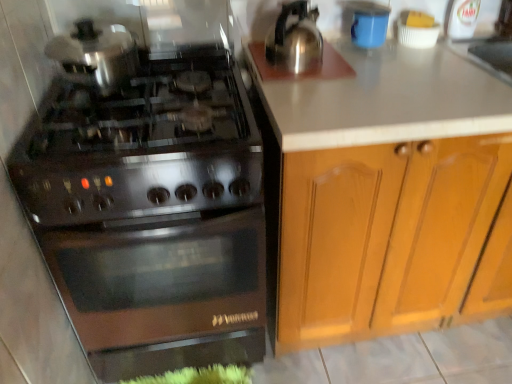
Find the location of a particular element. The height and width of the screenshot is (384, 512). free space that is to the left of blue matte cup at upper right is located at coordinates (327, 48).